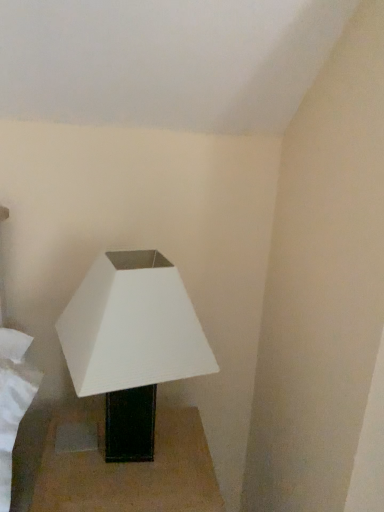
Question: Is white matte lamp at lower left positioned far away from black glossy table at lower center?

Choices:
 (A) no
 (B) yes

Answer: (A)

Question: Is the position of white matte lamp at lower left more distant than that of black glossy table at lower center?

Choices:
 (A) no
 (B) yes

Answer: (A)

Question: Can you confirm if white matte lamp at lower left is taller than black glossy table at lower center?

Choices:
 (A) yes
 (B) no

Answer: (A)

Question: Can we say white matte lamp at lower left lies outside black glossy table at lower center?

Choices:
 (A) no
 (B) yes

Answer: (B)

Question: Are white matte lamp at lower left and black glossy table at lower center making contact?

Choices:
 (A) yes
 (B) no

Answer: (B)

Question: Is black glossy table at lower center at the back of white matte lamp at lower left?

Choices:
 (A) no
 (B) yes

Answer: (A)

Question: Is black glossy table at lower center located outside white matte lamp at lower left?

Choices:
 (A) yes
 (B) no

Answer: (A)

Question: Considering the relative sizes of black glossy table at lower center and white matte lamp at lower left in the image provided, is black glossy table at lower center thinner than white matte lamp at lower left?

Choices:
 (A) no
 (B) yes

Answer: (A)

Question: Does black glossy table at lower center have a larger size compared to white matte lamp at lower left?

Choices:
 (A) yes
 (B) no

Answer: (A)

Question: Is black glossy table at lower center to the right of white matte lamp at lower left from the viewer's perspective?

Choices:
 (A) no
 (B) yes

Answer: (A)

Question: From a real-world perspective, does black glossy table at lower center stand above white matte lamp at lower left?

Choices:
 (A) yes
 (B) no

Answer: (B)

Question: Is white matte lamp at lower left a part of black glossy table at lower center?

Choices:
 (A) no
 (B) yes

Answer: (A)

Question: Is point (74, 508) positioned closer to the camera than point (129, 286)?

Choices:
 (A) closer
 (B) farther

Answer: (B)